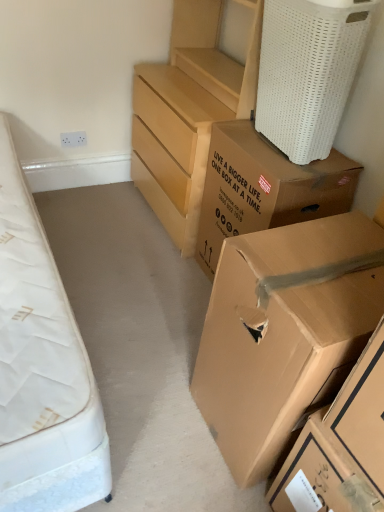
Consider the image. Measure the distance between point (298, 128) and camera.

Point (298, 128) and camera are 1.62 meters apart.

What do you see at coordinates (308, 72) in the screenshot? I see `white woven laundry basket at upper right` at bounding box center [308, 72].

This screenshot has height=512, width=384. What do you see at coordinates (264, 188) in the screenshot? I see `brown cardboard box at upper right, positioned as the 1th box in top-to-bottom order` at bounding box center [264, 188].

Describe the element at coordinates (340, 446) in the screenshot. The width and height of the screenshot is (384, 512). I see `brown cardboard box at lower right, the first box positioned from the bottom` at that location.

Locate an element on the screen. This screenshot has height=512, width=384. brown cardboard box at lower right, the second box viewed from the top is located at coordinates (285, 333).

Can you confirm if brown cardboard box at upper right, positioned as the 1th box in top-to-bottom order, is smaller than brown cardboard box at lower right, positioned as the 2th box in bottom-to-top order?

Correct, brown cardboard box at upper right, positioned as the 1th box in top-to-bottom order, occupies less space than brown cardboard box at lower right, positioned as the 2th box in bottom-to-top order.

Is the surface of brown cardboard box at upper right, the 3th box in the bottom-to-top sequence, in direct contact with brown cardboard box at lower right, positioned as the 2th box in bottom-to-top order?

No, brown cardboard box at upper right, the 3th box in the bottom-to-top sequence, is not making contact with brown cardboard box at lower right, positioned as the 2th box in bottom-to-top order.

What's the angular difference between brown cardboard box at upper right, positioned as the 1th box in top-to-bottom order, and brown cardboard box at lower right, positioned as the 2th box in bottom-to-top order,'s facing directions?

brown cardboard box at upper right, positioned as the 1th box in top-to-bottom order, and brown cardboard box at lower right, positioned as the 2th box in bottom-to-top order, are facing 0.000379 degrees away from each other.

Relative to white woven laundry basket at upper right, is brown cardboard box at lower right, the first box positioned from the bottom, in front or behind?

brown cardboard box at lower right, the first box positioned from the bottom, is in front of white woven laundry basket at upper right.

In terms of size, does brown cardboard box at lower right, the third box from the top, appear bigger or smaller than white woven laundry basket at upper right?

Considering their sizes, brown cardboard box at lower right, the third box from the top, takes up less space than white woven laundry basket at upper right.

Can you confirm if brown cardboard box at lower right, the first box positioned from the bottom, is wider than white woven laundry basket at upper right?

Yes.

I want to click on laundry basket that is behind the brown cardboard box at lower right, the third box from the top, so click(x=308, y=72).

Locate an element on the screen. This screenshot has width=384, height=512. box that is the 2nd one when counting downward from the brown cardboard box at upper right, positioned as the 1th box in top-to-bottom order (from the image's perspective) is located at coordinates (340, 446).

Is point (292, 181) positioned after point (383, 477)?

Yes, point (292, 181) is farther from viewer.

Who is bigger, brown cardboard box at upper right, the 3th box in the bottom-to-top sequence, or brown cardboard box at lower right, the first box positioned from the bottom?

Bigger between the two is brown cardboard box at upper right, the 3th box in the bottom-to-top sequence.

Is brown cardboard box at upper right, positioned as the 1th box in top-to-bottom order, beside brown cardboard box at lower right, the first box positioned from the bottom?

No, brown cardboard box at upper right, positioned as the 1th box in top-to-bottom order, is not beside brown cardboard box at lower right, the first box positioned from the bottom.

Which of these two, white woven laundry basket at upper right or brown cardboard box at upper right, positioned as the 1th box in top-to-bottom order, is wider?

With larger width is brown cardboard box at upper right, positioned as the 1th box in top-to-bottom order.

Measure the distance from white woven laundry basket at upper right to brown cardboard box at upper right, the 3th box in the bottom-to-top sequence.

white woven laundry basket at upper right is 10.71 inches away from brown cardboard box at upper right, the 3th box in the bottom-to-top sequence.

Is white woven laundry basket at upper right positioned beyond the bounds of brown cardboard box at upper right, positioned as the 1th box in top-to-bottom order?

Indeed, white woven laundry basket at upper right is completely outside brown cardboard box at upper right, positioned as the 1th box in top-to-bottom order.

Can you tell me how much white woven laundry basket at upper right and brown cardboard box at upper right, positioned as the 1th box in top-to-bottom order, differ in facing direction?

There is a 1.68-degree angle between the facing directions of white woven laundry basket at upper right and brown cardboard box at upper right, positioned as the 1th box in top-to-bottom order.

Is brown cardboard box at lower right, positioned as the 2th box in bottom-to-top order, closer to the viewer compared to white woven laundry basket at upper right?

Yes.

Between brown cardboard box at lower right, positioned as the 2th box in bottom-to-top order, and white woven laundry basket at upper right, which one has larger width?

brown cardboard box at lower right, positioned as the 2th box in bottom-to-top order, is wider.

From the image's perspective, does brown cardboard box at lower right, the second box viewed from the top, appear higher than white woven laundry basket at upper right?

No, from the image's perspective, brown cardboard box at lower right, the second box viewed from the top, is not over white woven laundry basket at upper right.

Looking at this image, is white woven laundry basket at upper right inside or outside of brown cardboard box at lower right, positioned as the 2th box in bottom-to-top order?

The correct answer is: outside.

Is the depth of white woven laundry basket at upper right greater than that of brown cardboard box at lower right, positioned as the 2th box in bottom-to-top order?

Yes.

Measure the distance from white woven laundry basket at upper right to brown cardboard box at lower right, the second box viewed from the top.

27.81 inches.

Does white woven laundry basket at upper right touch brown cardboard box at lower right, the second box viewed from the top?

white woven laundry basket at upper right and brown cardboard box at lower right, the second box viewed from the top, are clearly separated.

In the scene shown: Are brown cardboard box at lower right, positioned as the 2th box in bottom-to-top order, and brown cardboard box at upper right, the 3th box in the bottom-to-top sequence, located far from each other?

Actually, brown cardboard box at lower right, positioned as the 2th box in bottom-to-top order, and brown cardboard box at upper right, the 3th box in the bottom-to-top sequence, are a little close together.

Is brown cardboard box at lower right, positioned as the 2th box in bottom-to-top order, to the left of brown cardboard box at upper right, positioned as the 1th box in top-to-bottom order, from the viewer's perspective?

Incorrect, brown cardboard box at lower right, positioned as the 2th box in bottom-to-top order, is not on the left side of brown cardboard box at upper right, positioned as the 1th box in top-to-bottom order.

Which box is the 2nd one when counting from the front of the brown cardboard box at upper right, the 3th box in the bottom-to-top sequence? Please provide its 2D coordinates.

[(285, 333)]

Starting from the brown cardboard box at upper right, the 3th box in the bottom-to-top sequence, which box is the 2nd one in front? Please provide its 2D coordinates.

[(285, 333)]

At what (x,y) coordinates should I click in order to perform the action: click on laundry basket on the left of brown cardboard box at lower right, the first box positioned from the bottom. Please return your answer as a coordinate pair (x, y). Looking at the image, I should click on (308, 72).

Considering their positions, is matte wood chest of drawers at center positioned closer to brown cardboard box at upper right, positioned as the 1th box in top-to-bottom order, than brown cardboard box at lower right, the third box from the top?

matte wood chest of drawers at center is positioned closer to the anchor brown cardboard box at upper right, positioned as the 1th box in top-to-bottom order.

When comparing their distances from brown cardboard box at lower right, the third box from the top, does brown cardboard box at upper right, positioned as the 1th box in top-to-bottom order, or brown cardboard box at lower right, the second box viewed from the top, seem further?

brown cardboard box at upper right, positioned as the 1th box in top-to-bottom order.

From the picture: Looking at the image, which one is located closer to matte wood chest of drawers at center, brown cardboard box at upper right, positioned as the 1th box in top-to-bottom order, or white woven laundry basket at upper right?

The object closer to matte wood chest of drawers at center is brown cardboard box at upper right, positioned as the 1th box in top-to-bottom order.

From the picture: When comparing their distances from brown cardboard box at lower right, positioned as the 2th box in bottom-to-top order, does matte wood chest of drawers at center or white woven laundry basket at upper right seem further?

matte wood chest of drawers at center is positioned further to the anchor brown cardboard box at lower right, positioned as the 2th box in bottom-to-top order.

Looking at this image, from the image, which object appears to be farther from matte wood chest of drawers at center, brown cardboard box at upper right, the 3th box in the bottom-to-top sequence, or brown cardboard box at lower right, the third box from the top?

brown cardboard box at lower right, the third box from the top, is positioned further to the anchor matte wood chest of drawers at center.

Estimate the real-world distances between objects in this image. Which object is further from matte wood chest of drawers at center, brown cardboard box at lower right, the third box from the top, or brown cardboard box at upper right, the 3th box in the bottom-to-top sequence?

→ brown cardboard box at lower right, the third box from the top, lies further to matte wood chest of drawers at center than the other object.

Considering their positions, is white woven laundry basket at upper right positioned further to brown cardboard box at lower right, the third box from the top, than brown cardboard box at upper right, positioned as the 1th box in top-to-bottom order?

white woven laundry basket at upper right is positioned further to the anchor brown cardboard box at lower right, the third box from the top.

Based on their spatial positions, is brown cardboard box at upper right, the 3th box in the bottom-to-top sequence, or matte wood chest of drawers at center closer to brown cardboard box at lower right, the third box from the top?

brown cardboard box at upper right, the 3th box in the bottom-to-top sequence, is positioned closer to the anchor brown cardboard box at lower right, the third box from the top.

You are a GUI agent. You are given a task and a screenshot of the screen. Output one action in this format:
    pyautogui.click(x=<x>, y=<y>)
    Task: Click on the box between white woven laundry basket at upper right and brown cardboard box at lower right, the second box viewed from the top, from top to bottom
    The image size is (384, 512).
    Given the screenshot: What is the action you would take?
    pyautogui.click(x=264, y=188)

Find the location of `laundry basket that lies between matte wood chest of drawers at center and brown cardboard box at lower right, positioned as the 2th box in bottom-to-top order, from top to bottom`. laundry basket that lies between matte wood chest of drawers at center and brown cardboard box at lower right, positioned as the 2th box in bottom-to-top order, from top to bottom is located at coordinates (308, 72).

Find the location of a particular element. The width and height of the screenshot is (384, 512). laundry basket between matte wood chest of drawers at center and brown cardboard box at upper right, positioned as the 1th box in top-to-bottom order, from top to bottom is located at coordinates (308, 72).

Identify the location of box between matte wood chest of drawers at center and brown cardboard box at lower right, the second box viewed from the top, from top to bottom. (264, 188).